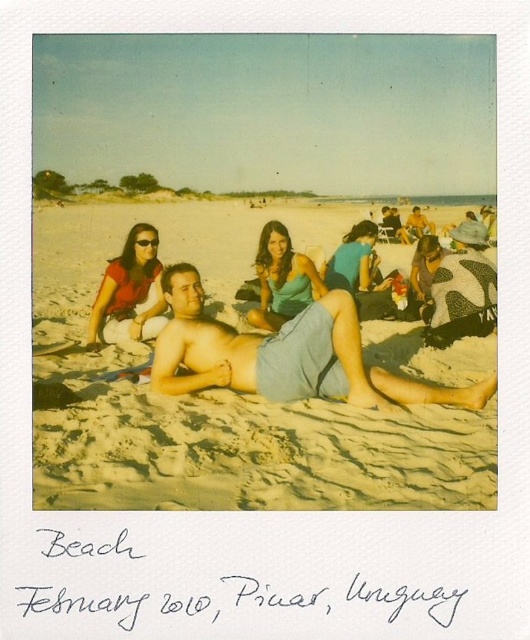
Question: Which point appears closest to the camera in this image?

Choices:
 (A) click(272, 339)
 (B) click(120, 259)
 (C) click(41, 444)
 (D) click(357, 257)

Answer: (C)

Question: Which object is closer to the camera taking this photo?

Choices:
 (A) matte teal tank top at center
 (B) matte red shirt at upper left
 (C) matte blue dress at center
 (D) denim shorts at center

Answer: (D)

Question: Can you confirm if denim shorts at center is positioned above matte blue dress at center?

Choices:
 (A) no
 (B) yes

Answer: (A)

Question: Can you confirm if matte red shirt at upper left is bigger than matte teal tank top at center?

Choices:
 (A) no
 (B) yes

Answer: (A)

Question: Does denim shorts at center appear over matte teal tank top at center?

Choices:
 (A) yes
 (B) no

Answer: (B)

Question: Among these points, which one is farthest from the camera?

Choices:
 (A) (269, 321)
 (B) (257, 401)

Answer: (A)